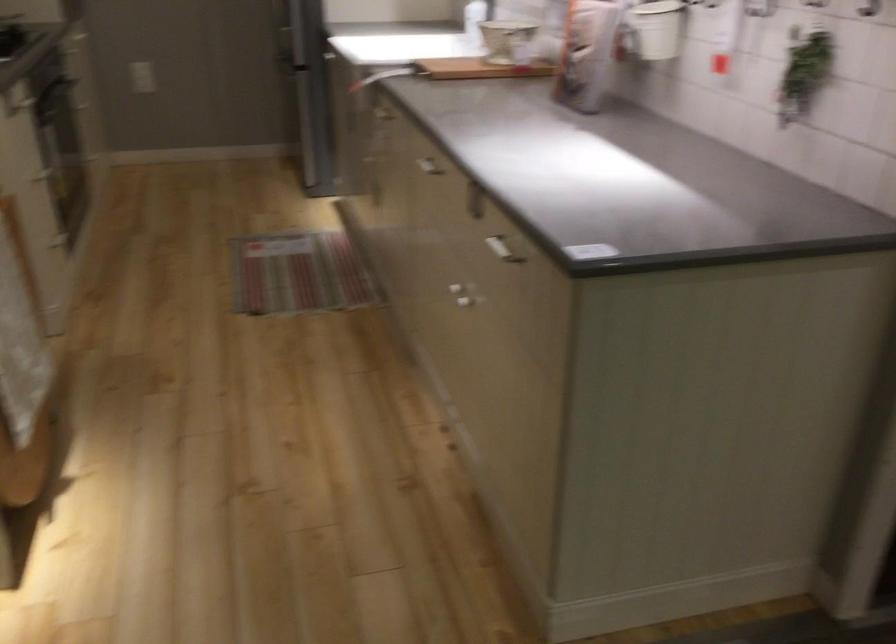
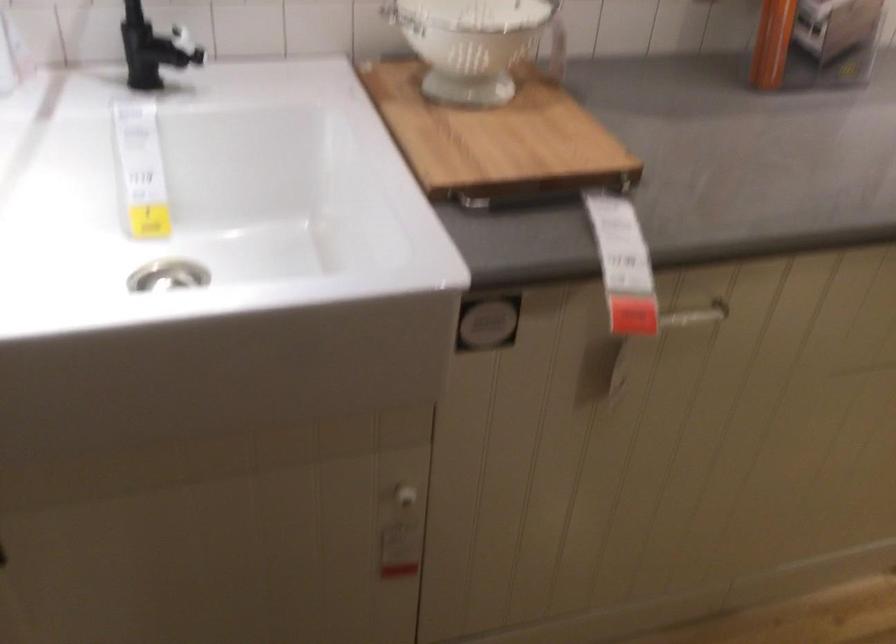
Locate, in the second image, the point that corresponds to point 460,67 in the first image.

(495, 138)